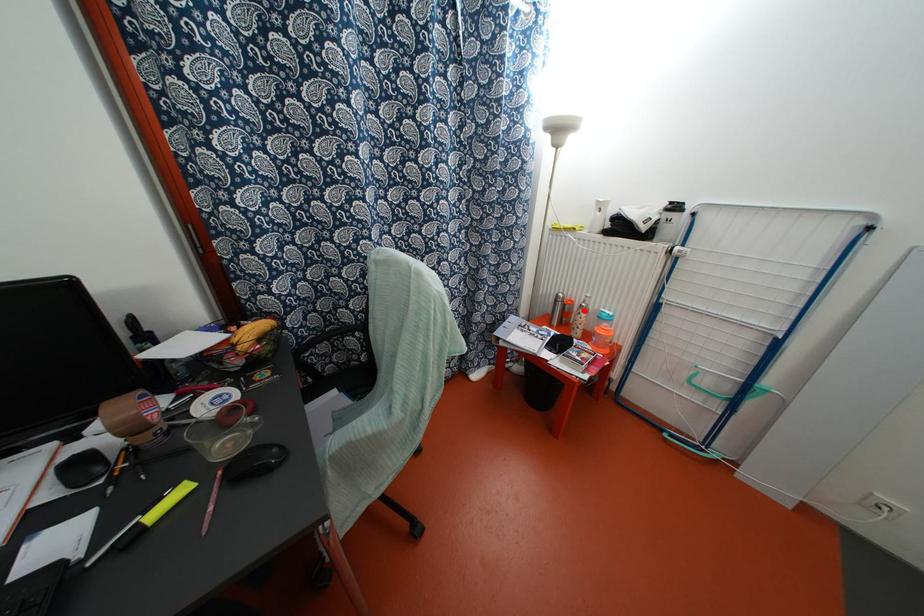
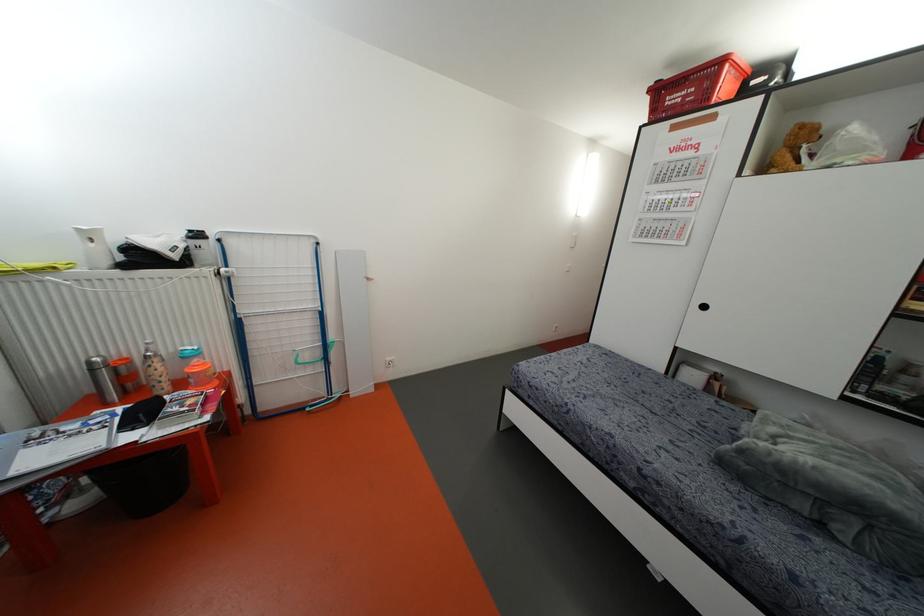
The point at the highlighted location is marked in the first image. Where is the corresponding point in the second image?

(155, 360)